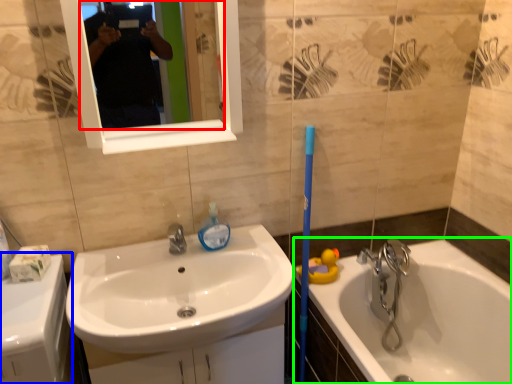
Question: Which is farther away from mirror (highlighted by a red box)? counter top (highlighted by a blue box) or bathtub (highlighted by a green box)?

Choices:
 (A) counter top
 (B) bathtub

Answer: (B)